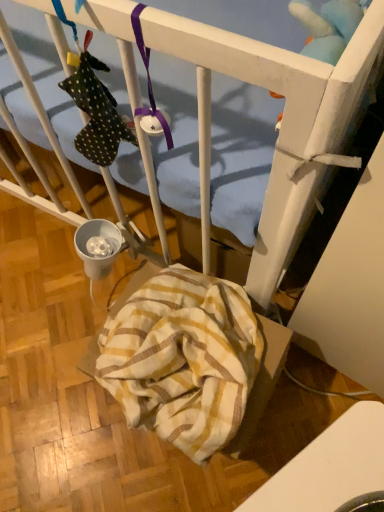
Locate an element on the screen. empty space that is in between white glossy table at lower right and yellow striped fabric at lower center is located at coordinates (220, 453).